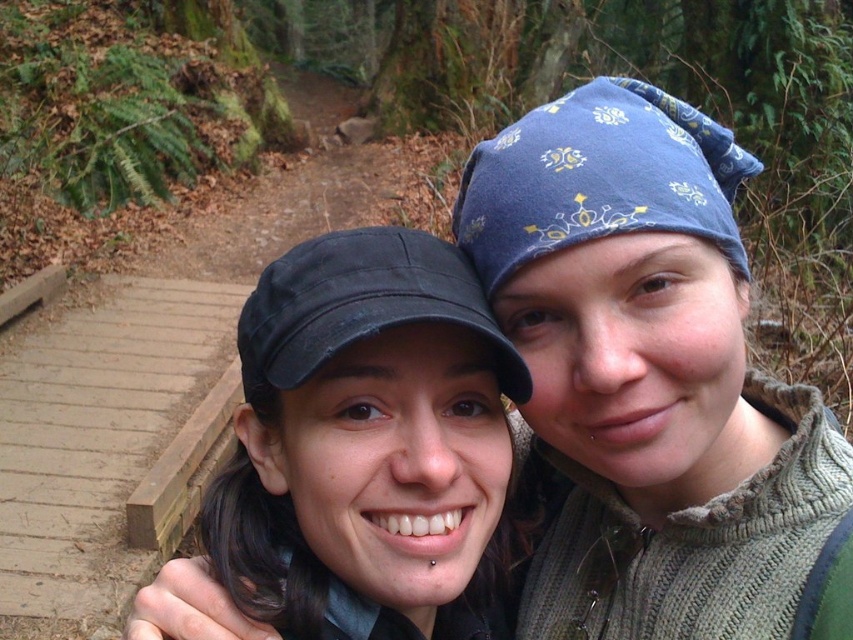
You are standing at the point marked at (701, 397) and want to walk to the nearest person. Which direction should you go?

The nearest person is the one on the right wearing a blue patterned headscarf and greenish gray sweater. You should walk towards them.

You are a photographer trying to capture the two hikers in the scene. You notice both the blue printed bandana at upper right and the blue printed fabric bandana at upper right. Which bandana is located more to the right side of the image?

The blue printed bandana at upper right is positioned on the right side of the blue printed fabric bandana at upper right, so it is more to the right.